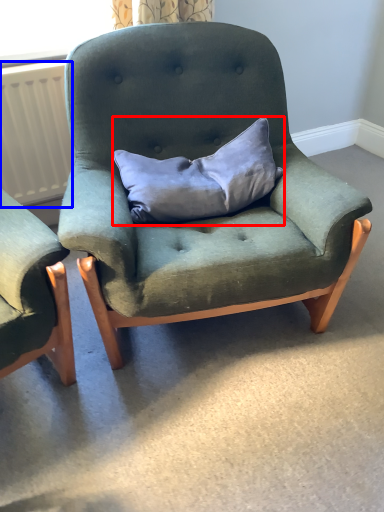
Question: Among these objects, which one is nearest to the camera, pillow (highlighted by a red box) or radiator (highlighted by a blue box)?

Choices:
 (A) pillow
 (B) radiator

Answer: (A)